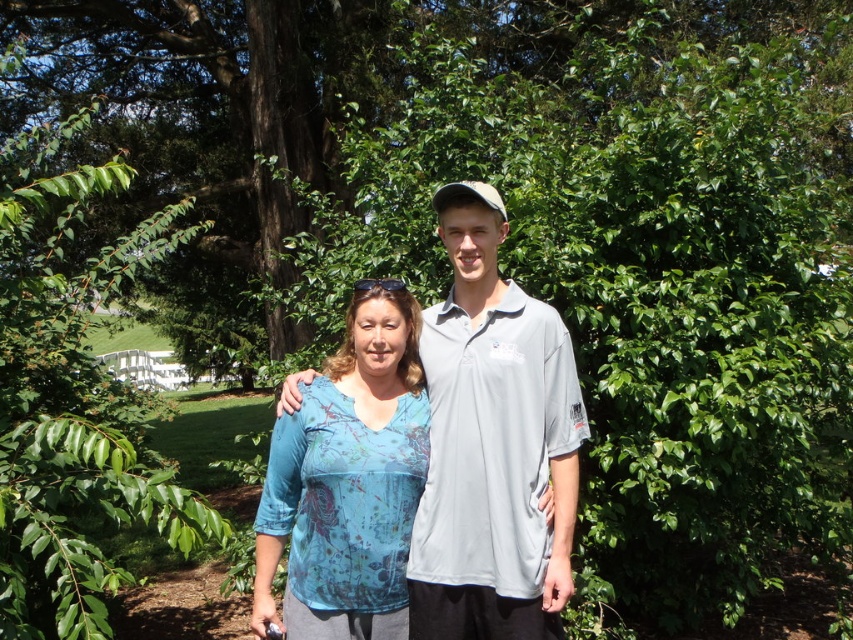
Consider the image. Is green leafy tree at upper left taller than blue printed shirt at center?

Incorrect, green leafy tree at upper left's height is not larger of blue printed shirt at center's.

What are the coordinates of `green leafy tree at upper left` in the screenshot? It's located at (73, 394).

Find the location of a particular element. The width and height of the screenshot is (853, 640). green leafy tree at upper left is located at coordinates (73, 394).

Is blue printed shirt at center further to the viewer compared to blue printed blouse at center?

No, blue printed shirt at center is in front of blue printed blouse at center.

In the scene shown: Who is more forward, [537,340] or [399,346]?

Point [537,340]

This screenshot has width=853, height=640. Find the location of `blue printed shirt at center`. blue printed shirt at center is located at coordinates tap(492, 444).

Is point (1, 275) positioned in front of point (296, 632)?

That is False.

Where is `green leafy tree at upper left`? The width and height of the screenshot is (853, 640). green leafy tree at upper left is located at coordinates (73, 394).